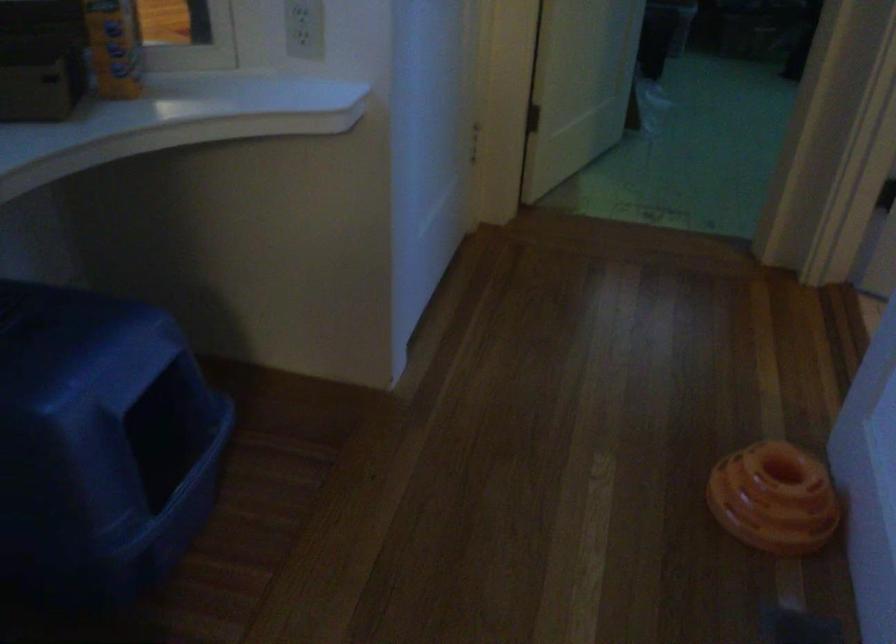
Describe the element at coordinates (99, 442) in the screenshot. I see `the litter box cover` at that location.